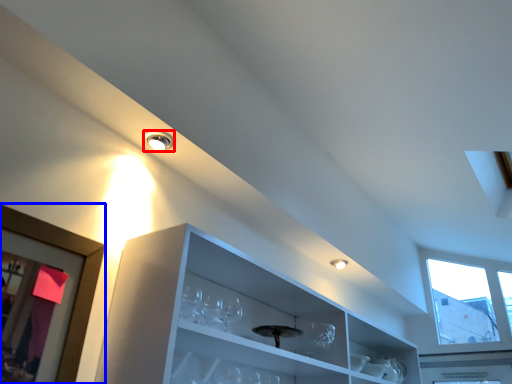
Question: Which object appears closest to the camera in this image, droplight (highlighted by a red box) or picture frame (highlighted by a blue box)?

Choices:
 (A) droplight
 (B) picture frame

Answer: (B)